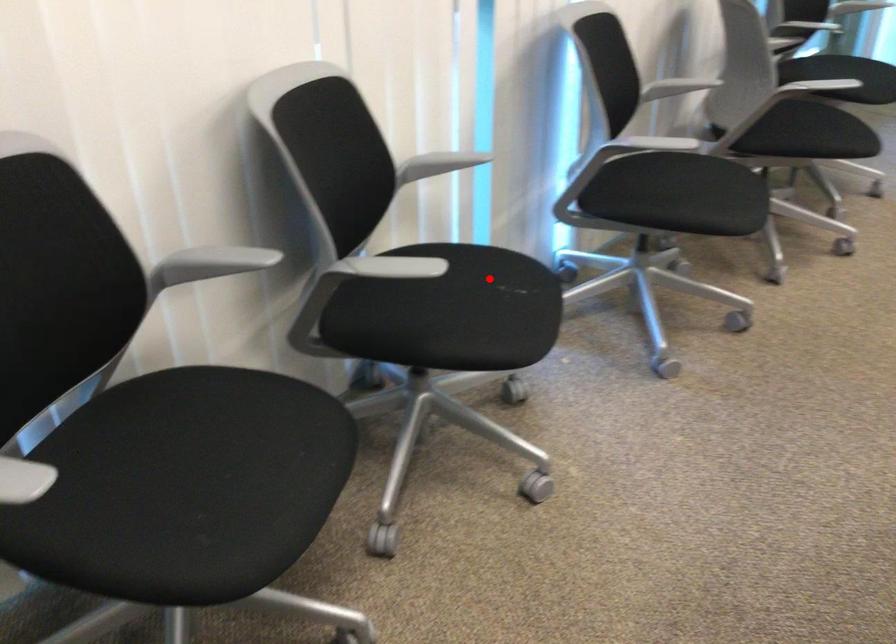
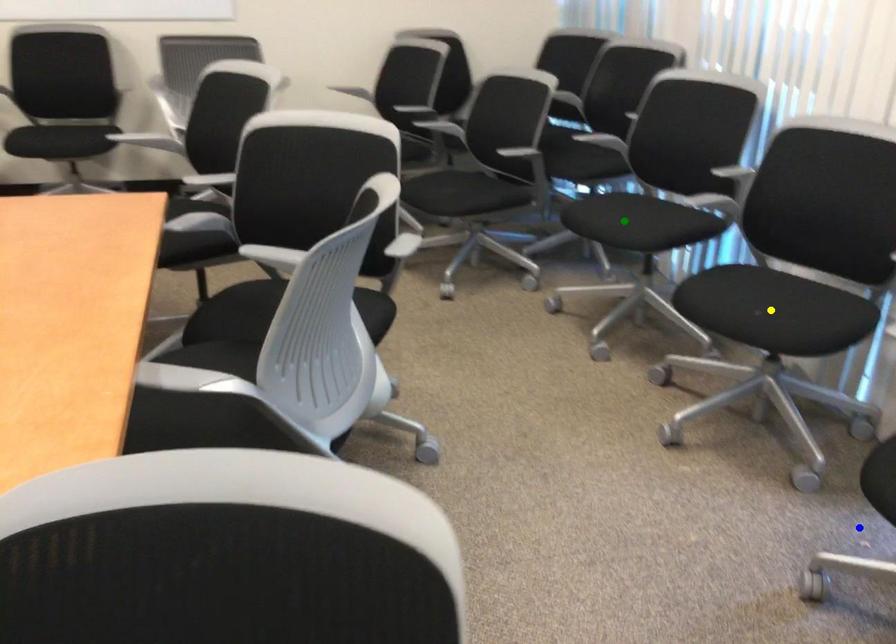
Question: I am providing you with two images of the same scene from different viewpoints. A red point is marked on the first image. You are given multiple points on the second image. Which spot in image 2 lines up with the point in image 1?

Choices:
 (A) blue point
 (B) yellow point
 (C) green point

Answer: (B)